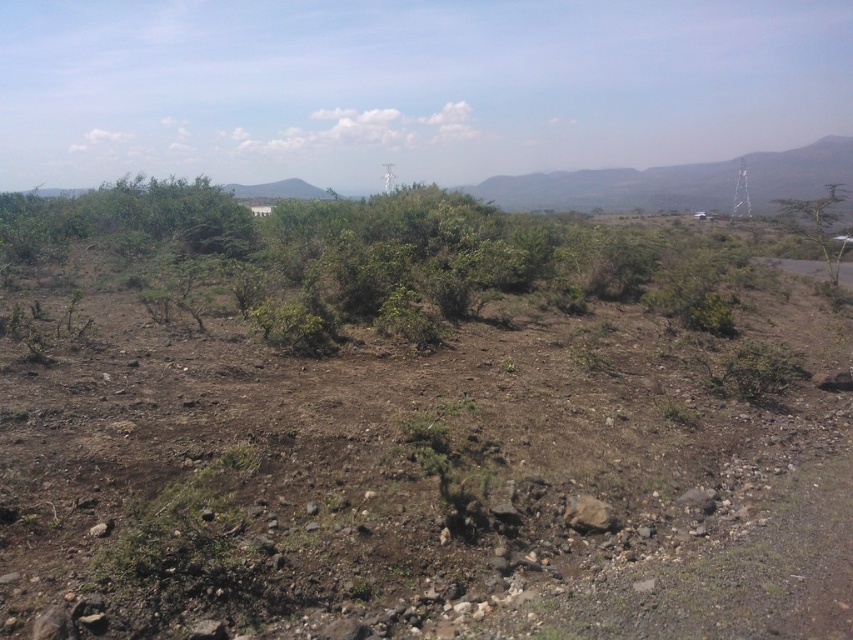
You are standing in the dry landscape and want to walk from the dull brown dirt at center to the green leafy tree at right. Which direction should you move to get closer to the tree?

You should move towards the green leafy tree at right, which is further away from you compared to the dull brown dirt at center. Since the dull brown dirt at center is closer to the viewer, moving away from it towards the tree would be the correct direction.

You are a hiker trying to find shade in this dry landscape. You see the dull brown dirt at center and the green leafy tree at right. Which of these two objects would provide more coverage for shade?

The green leafy tree at right occupies more space than the dull brown dirt at center, so it would provide more shade coverage.

You are standing in the dry landscape and want to walk from the point at coordinates (537, 563) to the point at (787, 220). Which direction should you move relative to your current position?

You should move towards the upper right direction because point (787, 220) is further away from the camera than point (537, 563), so it is located in the upper right direction from your current position.